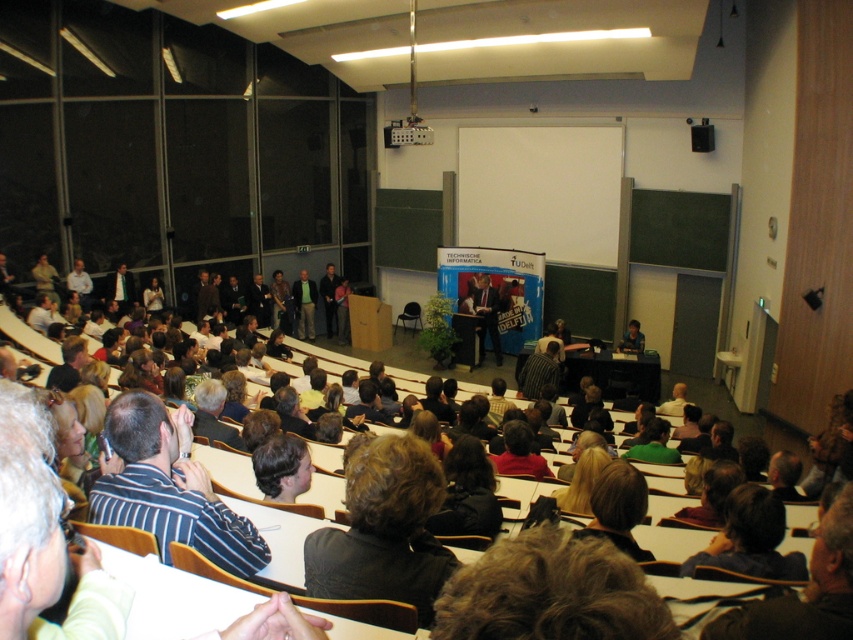
Find the location of `striped fabric shirt at lower left`. striped fabric shirt at lower left is located at coordinates (169, 486).

Can you confirm if striped fabric shirt at lower left is positioned to the right of green fabric shirt at center?

Indeed, striped fabric shirt at lower left is positioned on the right side of green fabric shirt at center.

Locate an element on the screen. striped fabric shirt at lower left is located at coordinates pos(169,486).

Which is more to the left, dark blue suit at center or green fabric shirt at center?

Positioned to the left is green fabric shirt at center.

Is point (491, 298) closer to viewer compared to point (299, 285)?

Yes, it is.

Locate an element on the screen. The height and width of the screenshot is (640, 853). dark blue suit at center is located at coordinates (486, 316).

Can you confirm if striped fabric shirt at lower left is smaller than dark blue suit at center?

Indeed, striped fabric shirt at lower left has a smaller size compared to dark blue suit at center.

In the scene shown: Is striped fabric shirt at lower left wider than dark blue suit at center?

No.

Who is more forward, (239, 524) or (479, 289)?

Point (239, 524) is more forward.

You are a GUI agent. You are given a task and a screenshot of the screen. Output one action in this format:
    pyautogui.click(x=<x>, y=<y>)
    Task: Click on the striped fabric shirt at lower left
    This screenshot has height=640, width=853.
    Given the screenshot: What is the action you would take?
    pyautogui.click(x=169, y=486)